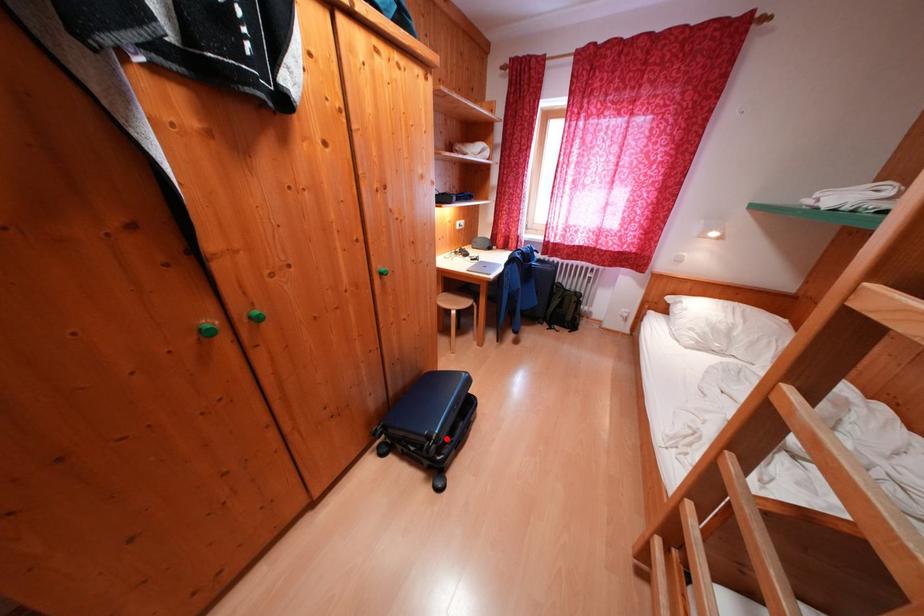
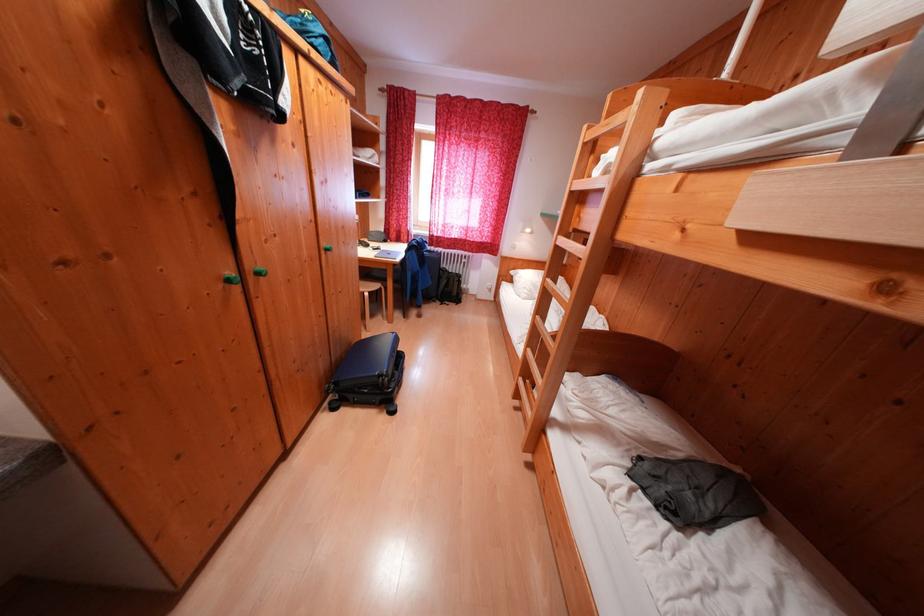
Find the pixel in the second image that matches the highlighted location in the first image.

(395, 376)